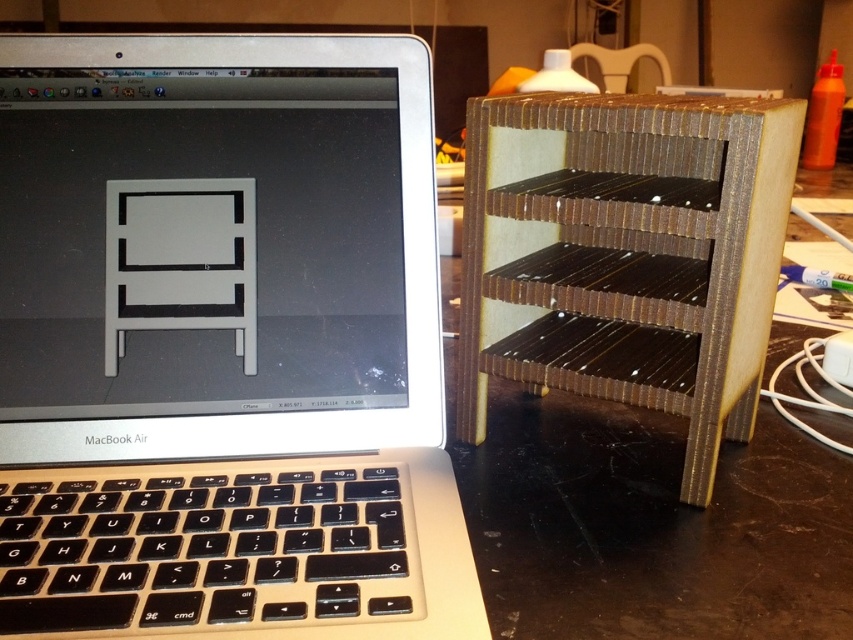
Between wooden/matte shelf at right and wooden chair at upper center, which one appears on the left side from the viewer's perspective?

wooden/matte shelf at right is more to the left.

Between point (675, 195) and point (625, 68), which one is positioned in front?

Point (675, 195) is more forward.

At what (x,y) coordinates should I click in order to perform the action: click on wooden/matte shelf at right. Please return your answer as a coordinate pair (x, y). Looking at the image, I should click on (625, 253).

Is white matte/transparent object at upper left shorter than wooden/matte shelf at right?

Indeed, white matte/transparent object at upper left has a lesser height compared to wooden/matte shelf at right.

Which of these two, white matte/transparent object at upper left or wooden/matte shelf at right, stands taller?

Standing taller between the two is wooden/matte shelf at right.

Describe the element at coordinates (199, 243) in the screenshot. I see `white matte/transparent object at upper left` at that location.

You are a GUI agent. You are given a task and a screenshot of the screen. Output one action in this format:
    pyautogui.click(x=<x>, y=<y>)
    Task: Click on the white matte/transparent object at upper left
    
    Given the screenshot: What is the action you would take?
    pyautogui.click(x=199, y=243)

Can you confirm if silver/black plastic laptop at left is taller than white matte/transparent object at upper left?

Yes, silver/black plastic laptop at left is taller than white matte/transparent object at upper left.

Is silver/black plastic laptop at left positioned before white matte/transparent object at upper left?

Yes, silver/black plastic laptop at left is closer to the viewer.

Who is more distant from viewer, (x=395, y=220) or (x=289, y=81)?

The point (x=395, y=220) is more distant.

Identify the location of silver/black plastic laptop at left. The width and height of the screenshot is (853, 640). [x=223, y=342].